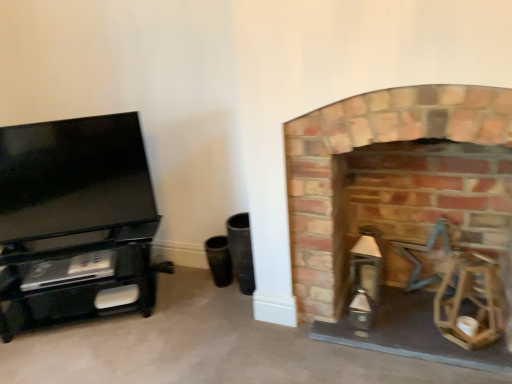
The height and width of the screenshot is (384, 512). I want to click on vacant point to the left of brick fireplace at right, so click(260, 342).